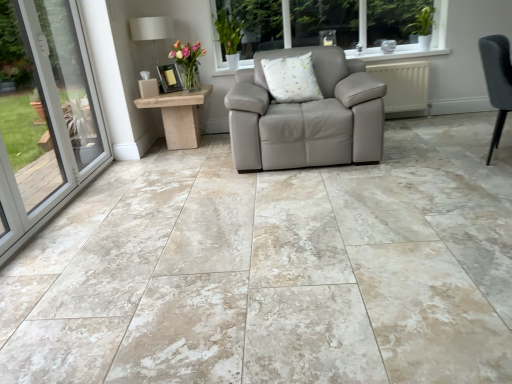
Question: Does point (159, 26) appear closer or farther from the camera than point (280, 289)?

Choices:
 (A) closer
 (B) farther

Answer: (B)

Question: From a real-world perspective, is white fabric lampshade at upper left above or below beige marble floor at center?

Choices:
 (A) above
 (B) below

Answer: (A)

Question: Which object is the closest to the matte black picture frame at center?

Choices:
 (A) translucent glass vase at upper center
 (B) wooden side table at left
 (C) white fabric lampshade at upper left
 (D) beige marble floor at center
 (E) dark gray fabric chair at right

Answer: (A)

Question: Which object is positioned farthest from the beige marble floor at center?

Choices:
 (A) translucent glass vase at upper center
 (B) dark gray fabric chair at right
 (C) wooden side table at left
 (D) white fabric lampshade at upper left
 (E) matte black picture frame at center

Answer: (D)